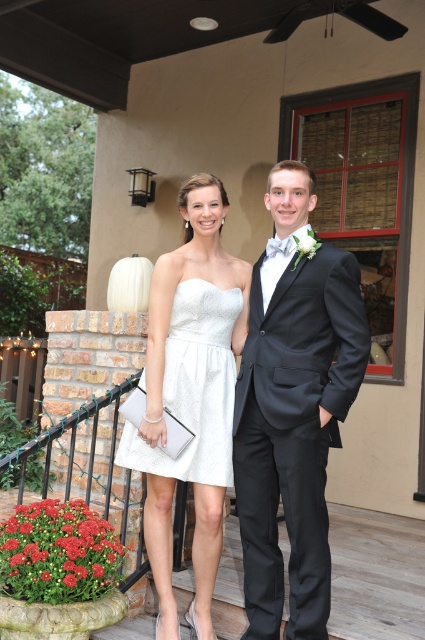
Locate an element on the screen. The image size is (425, 640). satin white dress at center is located at coordinates (190, 394).

Does satin white dress at center have a smaller size compared to white lace dress at center?

Actually, satin white dress at center might be larger than white lace dress at center.

Is point (161, 486) closer to viewer compared to point (167, 358)?

No, (161, 486) is behind (167, 358).

Locate an element on the screen. Image resolution: width=425 pixels, height=640 pixels. satin white dress at center is located at coordinates (190, 394).

Can you confirm if shiny black suit at center is thinner than satin white dress at center?

Yes, shiny black suit at center is thinner than satin white dress at center.

Is shiny black suit at center further to camera compared to satin white dress at center?

No, it is in front of satin white dress at center.

Which is in front, point (269, 355) or point (207, 634)?

Positioned in front is point (269, 355).

The image size is (425, 640). Find the location of `shiny black suit at center`. shiny black suit at center is located at coordinates (292, 408).

Image resolution: width=425 pixels, height=640 pixels. I want to click on shiny black suit at center, so click(292, 408).

Locate an element on the screen. This screenshot has width=425, height=640. shiny black suit at center is located at coordinates (292, 408).

Find the location of `shiny black suit at center`. shiny black suit at center is located at coordinates (292, 408).